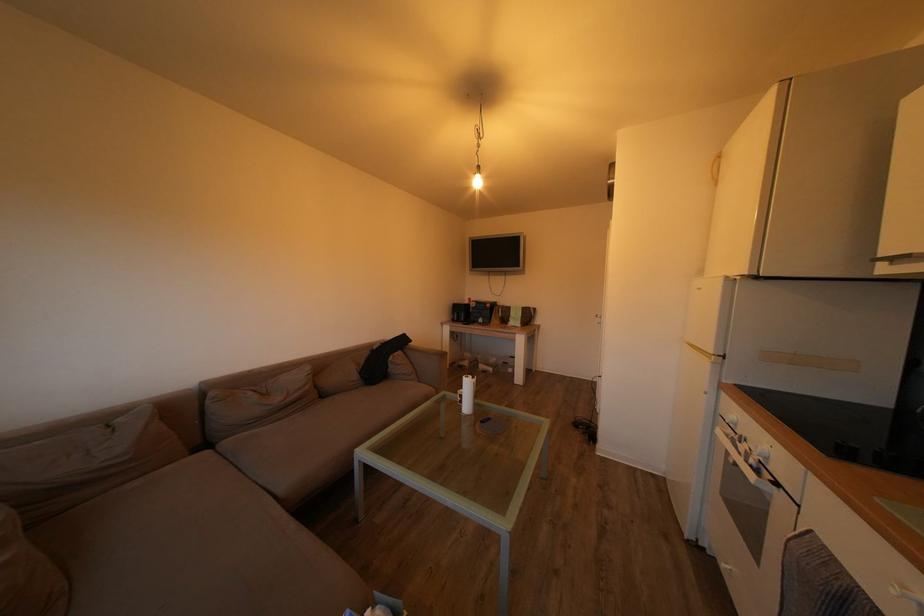
Which object does [459,312] point to?

This point indicates the black speaker.